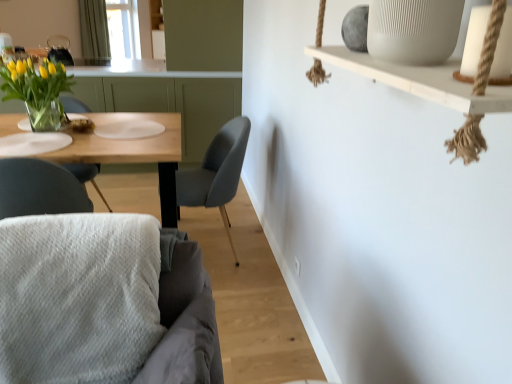
Describe the element at coordinates (38, 91) in the screenshot. I see `translucent glass vase with yellow tulips at left` at that location.

The width and height of the screenshot is (512, 384). Describe the element at coordinates (216, 173) in the screenshot. I see `matte gray chair at center, the second chair positioned from the front` at that location.

Image resolution: width=512 pixels, height=384 pixels. I want to click on green fabric curtain at upper left, so click(x=94, y=32).

The image size is (512, 384). What do you see at coordinates (94, 32) in the screenshot? I see `green fabric curtain at upper left` at bounding box center [94, 32].

Locate an element on the screen. white textured cushion at lower left, which is the first chair in front-to-back order is located at coordinates (102, 304).

What do you see at coordinates (123, 29) in the screenshot? The image size is (512, 384). I see `transparent glass window screen at upper center` at bounding box center [123, 29].

Identify the location of wooden table at left. (132, 152).

Is white textured cushion at lower left, arranged as the second chair when viewed from the back, surrounded by clear glass vase at left?

No, clear glass vase at left does not contain white textured cushion at lower left, arranged as the second chair when viewed from the back.

Are clear glass vase at left and white textured cushion at lower left, which is the first chair in front-to-back order, far apart?

That's right, there is a large distance between clear glass vase at left and white textured cushion at lower left, which is the first chair in front-to-back order.

Is clear glass vase at left shorter than white textured cushion at lower left, arranged as the second chair when viewed from the back?

Indeed, clear glass vase at left has a lesser height compared to white textured cushion at lower left, arranged as the second chair when viewed from the back.

Does point (67, 121) appear closer or farther from the camera than point (199, 263)?

Point (67, 121) is positioned farther from the camera compared to point (199, 263).

Is clear glass vase at left closer to camera compared to matte gray chair at center, the first chair viewed from the back?

No, clear glass vase at left is behind matte gray chair at center, the first chair viewed from the back.

From a real-world perspective, which is physically below, clear glass vase at left or matte gray chair at center, the second chair positioned from the front?

matte gray chair at center, the second chair positioned from the front, is physically lower.

From the picture: From the image's perspective, which one is positioned higher, clear glass vase at left or matte gray chair at center, the second chair positioned from the front?

clear glass vase at left, from the image's perspective.

From a real-world perspective, who is located lower, transparent glass window screen at upper center or clear glass vase at left?

clear glass vase at left, from a real-world perspective.

Is transparent glass window screen at upper center looking in the opposite direction of clear glass vase at left?

transparent glass window screen at upper center does not have its back to clear glass vase at left.

Is transparent glass window screen at upper center closer to camera compared to clear glass vase at left?

No, the depth of transparent glass window screen at upper center is greater than that of clear glass vase at left.

Considering the sizes of objects transparent glass window screen at upper center and clear glass vase at left in the image provided, who is thinner, transparent glass window screen at upper center or clear glass vase at left?

Thinner between the two is transparent glass window screen at upper center.

From the picture: Can you tell me how much clear glass vase at left and translucent glass vase with yellow tulips at left differ in facing direction?

They differ by 178 degrees in their facing directions.

From the image's perspective, which one is positioned higher, clear glass vase at left or translucent glass vase with yellow tulips at left?

translucent glass vase with yellow tulips at left appears higher in the image.

In order to click on houseplant above the clear glass vase at left (from a real-world perspective) in this screenshot , I will do `click(38, 91)`.

Does clear glass vase at left have a lesser width compared to translucent glass vase with yellow tulips at left?

Yes.

Considering the sizes of objects matte gray chair at center, the second chair positioned from the front, and translucent glass vase with yellow tulips at left in the image provided, who is taller, matte gray chair at center, the second chair positioned from the front, or translucent glass vase with yellow tulips at left?

matte gray chair at center, the second chair positioned from the front.

Between matte gray chair at center, the first chair viewed from the back, and translucent glass vase with yellow tulips at left, which one has larger width?

With larger width is matte gray chair at center, the first chair viewed from the back.

Is matte gray chair at center, the first chair viewed from the back, further to camera compared to translucent glass vase with yellow tulips at left?

Yes, it is behind translucent glass vase with yellow tulips at left.

There is a translucent glass vase with yellow tulips at left. Where is `the 2nd chair below it (from a real-world perspective)`? This screenshot has width=512, height=384. the 2nd chair below it (from a real-world perspective) is located at coordinates (216, 173).

Is white textured cushion at lower left, arranged as the second chair when viewed from the back, further to the viewer compared to wooden table at left?

No, it is in front of wooden table at left.

Is white textured cushion at lower left, arranged as the second chair when viewed from the back, touching wooden table at left?

No, white textured cushion at lower left, arranged as the second chair when viewed from the back, is not with wooden table at left.

Which object is wider, white textured cushion at lower left, which is the first chair in front-to-back order, or wooden table at left?

wooden table at left.

Considering the positions of objects transparent glass window screen at upper center and white textured cushion at lower left, arranged as the second chair when viewed from the back, in the image provided, who is more to the right, transparent glass window screen at upper center or white textured cushion at lower left, arranged as the second chair when viewed from the back,?

white textured cushion at lower left, arranged as the second chair when viewed from the back, is more to the right.

Is transparent glass window screen at upper center next to white textured cushion at lower left, which is the first chair in front-to-back order, and touching it?

No.

Does transparent glass window screen at upper center turn towards white textured cushion at lower left, arranged as the second chair when viewed from the back?

No, transparent glass window screen at upper center is not oriented towards white textured cushion at lower left, arranged as the second chair when viewed from the back.

From a real-world perspective, does transparent glass window screen at upper center stand above white textured cushion at lower left, arranged as the second chair when viewed from the back?

Yes.

The width and height of the screenshot is (512, 384). I want to click on vase above the white textured cushion at lower left, which is the first chair in front-to-back order (from a real-world perspective), so click(47, 117).

In order to click on vase that is above the matte gray chair at center, the second chair positioned from the front (from the image's perspective) in this screenshot , I will do `click(47, 117)`.

From the image, which object appears to be farther from transparent glass window screen at upper center, clear glass vase at left or green fabric curtain at upper left?

The object further to transparent glass window screen at upper center is clear glass vase at left.

Looking at the image, which one is located closer to green fabric curtain at upper left, matte gray chair at center, the second chair positioned from the front, or white textured cushion at lower left, arranged as the second chair when viewed from the back?

Based on the image, matte gray chair at center, the second chair positioned from the front, appears to be nearer to green fabric curtain at upper left.

Considering their positions, is clear glass vase at left positioned closer to translucent glass vase with yellow tulips at left than white textured cushion at lower left, arranged as the second chair when viewed from the back?

clear glass vase at left.

Estimate the real-world distances between objects in this image. Which object is closer to green fabric curtain at upper left, translucent glass vase with yellow tulips at left or wooden table at left?

translucent glass vase with yellow tulips at left is closer to green fabric curtain at upper left.

Based on their spatial positions, is transparent glass window screen at upper center or green fabric curtain at upper left further from matte gray chair at center, the second chair positioned from the front?

transparent glass window screen at upper center is positioned further to the anchor matte gray chair at center, the second chair positioned from the front.

Looking at the image, which one is located further to clear glass vase at left, transparent glass window screen at upper center or matte gray chair at center, the first chair viewed from the back?

The object further to clear glass vase at left is transparent glass window screen at upper center.

Based on their spatial positions, is white textured cushion at lower left, which is the first chair in front-to-back order, or clear glass vase at left closer to translucent glass vase with yellow tulips at left?

Based on the image, clear glass vase at left appears to be nearer to translucent glass vase with yellow tulips at left.

Considering their positions, is translucent glass vase with yellow tulips at left positioned closer to white textured cushion at lower left, arranged as the second chair when viewed from the back, than matte gray chair at center, the second chair positioned from the front?

Among the two, matte gray chair at center, the second chair positioned from the front, is located nearer to white textured cushion at lower left, arranged as the second chair when viewed from the back.

This screenshot has height=384, width=512. In order to click on chair between translucent glass vase with yellow tulips at left and transparent glass window screen at upper center from front to back in this screenshot , I will do `click(216, 173)`.

Where is `table located between white textured cushion at lower left, arranged as the second chair when viewed from the back, and matte gray chair at center, the first chair viewed from the back, in the depth direction`? This screenshot has height=384, width=512. table located between white textured cushion at lower left, arranged as the second chair when viewed from the back, and matte gray chair at center, the first chair viewed from the back, in the depth direction is located at coordinates (132, 152).

In order to click on houseplant located between white textured cushion at lower left, which is the first chair in front-to-back order, and transparent glass window screen at upper center in the depth direction in this screenshot , I will do `click(38, 91)`.

Where is `table between clear glass vase at left and matte gray chair at center, the second chair positioned from the front`? table between clear glass vase at left and matte gray chair at center, the second chair positioned from the front is located at coordinates (132, 152).